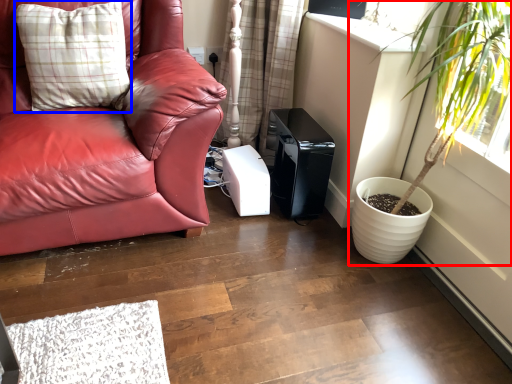
Question: Which object appears closest to the camera in this image, houseplant (highlighted by a red box) or pillow (highlighted by a blue box)?

Choices:
 (A) houseplant
 (B) pillow

Answer: (A)